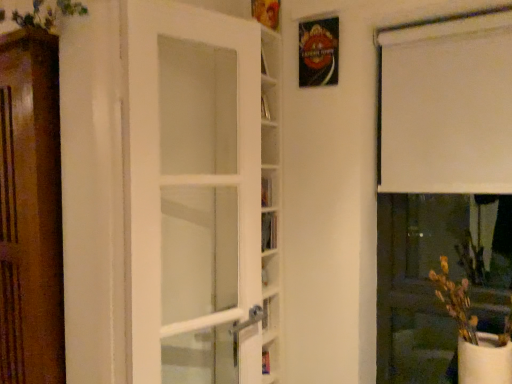
Image resolution: width=512 pixels, height=384 pixels. Describe the element at coordinates (40, 12) in the screenshot. I see `green leafy plant at upper left` at that location.

Image resolution: width=512 pixels, height=384 pixels. Describe the element at coordinates (437, 274) in the screenshot. I see `white matte vase at lower right` at that location.

The width and height of the screenshot is (512, 384). I want to click on white matte vase at lower right, so click(x=437, y=274).

This screenshot has width=512, height=384. I want to click on metallic poster at upper center, so click(318, 52).

What is the approximate height of white glass door at center?

The height of white glass door at center is 1.22 meters.

Where is `white matte curtain at upper right`? white matte curtain at upper right is located at coordinates (447, 107).

Considering the sizes of objects metallic poster at upper center and hardcover book at center in the image provided, who is shorter, metallic poster at upper center or hardcover book at center?

hardcover book at center is shorter.

Based on the photo, from a real-world perspective, is metallic poster at upper center on hardcover book at center?

Correct, in the physical world, metallic poster at upper center is higher than hardcover book at center.

From the picture: Is hardcover book at center completely or partially inside metallic poster at upper center?

No, hardcover book at center is not a part of metallic poster at upper center.

Is point (311, 42) positioned before point (263, 195)?

Yes, point (311, 42) is in front of point (263, 195).

In terms of size, does white matte curtain at upper right appear bigger or smaller than white matte vase at lower right?

In the image, white matte curtain at upper right appears to be smaller than white matte vase at lower right.

Considering the relative sizes of white matte curtain at upper right and white matte vase at lower right in the image provided, is white matte curtain at upper right wider than white matte vase at lower right?

No, white matte curtain at upper right is not wider than white matte vase at lower right.

From the image's perspective, who appears lower, white matte curtain at upper right or white matte vase at lower right?

white matte vase at lower right is shown below in the image.

Where is `screen door that is below the white matte curtain at upper right (from the image's perspective)`? This screenshot has height=384, width=512. screen door that is below the white matte curtain at upper right (from the image's perspective) is located at coordinates (437, 274).

Can you see white glass door at center touching white matte curtain at upper right?

No, white glass door at center is not making contact with white matte curtain at upper right.

Is point (175, 316) closer or farther from the camera than point (450, 153)?

Clearly, point (175, 316) is closer to the camera than point (450, 153).

Where is `curtain on the right of white glass door at center`? The height and width of the screenshot is (384, 512). curtain on the right of white glass door at center is located at coordinates (447, 107).

Considering the positions of objects white glass door at center and white matte curtain at upper right in the image provided, who is in front, white glass door at center or white matte curtain at upper right?

Positioned in front is white glass door at center.

Is metallic poster at upper center next to green leafy plant at upper left and touching it?

metallic poster at upper center and green leafy plant at upper left are not in contact.

Between point (332, 68) and point (19, 22), which one is positioned in front?

Positioned in front is point (19, 22).

From a real-world perspective, is metallic poster at upper center physically below green leafy plant at upper left?

Indeed, from a real-world perspective, metallic poster at upper center is positioned beneath green leafy plant at upper left.

Considering the positions of point (261, 200) and point (34, 14), is point (261, 200) closer or farther from the camera than point (34, 14)?

Clearly, point (261, 200) is more distant from the camera than point (34, 14).

Is hardcover book at center at the left side of green leafy plant at upper left?

No, hardcover book at center is not to the left of green leafy plant at upper left.

Is hardcover book at center further to the viewer compared to green leafy plant at upper left?

Yes, hardcover book at center is behind green leafy plant at upper left.

From a real-world perspective, is hardcover book at center over green leafy plant at upper left?

No, from a real-world perspective, hardcover book at center is not over green leafy plant at upper left

Is white matte curtain at upper right beside metallic poster at upper center?

No, white matte curtain at upper right is not touching metallic poster at upper center.

Which is more to the left, white matte curtain at upper right or metallic poster at upper center?

metallic poster at upper center is more to the left.

What's the angular difference between white matte curtain at upper right and metallic poster at upper center's facing directions?

There is a 0.667-degree angle between the facing directions of white matte curtain at upper right and metallic poster at upper center.

Is point (500, 29) positioned behind point (324, 65)?

No, (500, 29) is in front of (324, 65).

From a real-world perspective, is white matte vase at lower right above or below white glass door at center?

Clearly, from a real-world perspective, white matte vase at lower right is below white glass door at center.

In the image, is white matte vase at lower right positioned in front of or behind white glass door at center?

white matte vase at lower right is behind white glass door at center.

Between white matte vase at lower right and white glass door at center, which one has smaller size?

white matte vase at lower right is smaller.

Where is `picture frame lying on the right of hardcover book at center`? picture frame lying on the right of hardcover book at center is located at coordinates (318, 52).

The width and height of the screenshot is (512, 384). Identify the location of screen door in front of the white matte curtain at upper right. (437, 274).

From the image, which object appears to be nearer to white glass door at center, metallic poster at upper center or green leafy plant at upper left?

metallic poster at upper center lies closer to white glass door at center than the other object.

In the scene shown: Looking at the image, which one is located further to white matte curtain at upper right, hardcover book at center or white glass door at center?

Based on the image, white glass door at center appears to be further to white matte curtain at upper right.

Based on their spatial positions, is white matte curtain at upper right or metallic poster at upper center further from hardcover book at center?

white matte curtain at upper right is positioned further to the anchor hardcover book at center.

From the image, which object appears to be farther from metallic poster at upper center, green leafy plant at upper left or white glass door at center?

Based on the image, green leafy plant at upper left appears to be further to metallic poster at upper center.

When comparing their distances from white matte curtain at upper right, does white glass door at center or metallic poster at upper center seem further?

white glass door at center lies further to white matte curtain at upper right than the other object.

From the image, which object appears to be farther from hardcover book at center, white glass door at center or white matte curtain at upper right?

Among the two, white matte curtain at upper right is located further to hardcover book at center.

In the scene shown: From the image, which object appears to be nearer to green leafy plant at upper left, hardcover book at center or metallic poster at upper center?

Among the two, metallic poster at upper center is located nearer to green leafy plant at upper left.

Based on their spatial positions, is white matte vase at lower right or hardcover book at center closer to white glass door at center?

hardcover book at center.

At what (x,y) coordinates should I click in order to perform the action: click on screen door between white glass door at center and white matte curtain at upper right in the horizontal direction. Please return your answer as a coordinate pair (x, y). This screenshot has height=384, width=512. Looking at the image, I should click on (437, 274).

Where is `door between green leafy plant at upper left and metallic poster at upper center from left to right`? Image resolution: width=512 pixels, height=384 pixels. door between green leafy plant at upper left and metallic poster at upper center from left to right is located at coordinates (189, 177).

The width and height of the screenshot is (512, 384). What are the coordinates of `door between metallic poster at upper center and white matte vase at lower right from top to bottom` in the screenshot? It's located at (189, 177).

Where is `book located between white glass door at center and white matte vase at lower right in the left-right direction`? This screenshot has height=384, width=512. book located between white glass door at center and white matte vase at lower right in the left-right direction is located at coordinates (266, 192).